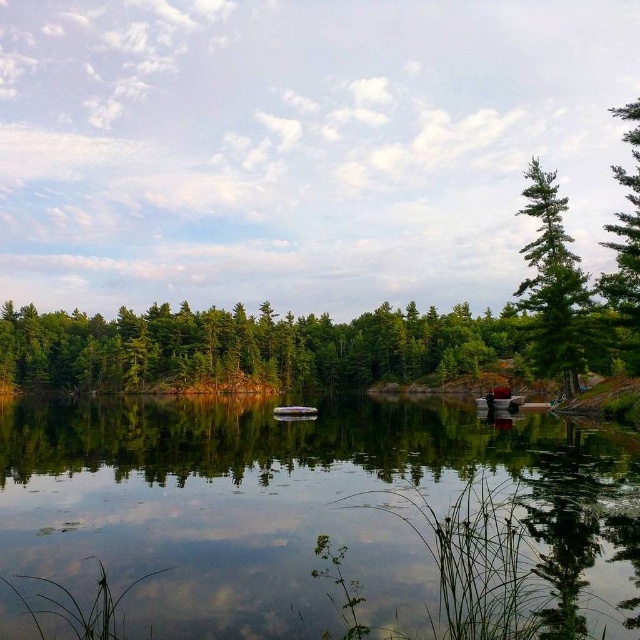
You are planning to take a boat ride on the lake. You see the metallic red boat at lower right and the metallic silver boat at center. Which boat should you choose if you want a larger vessel?

The metallic red boat at lower right is bigger than the metallic silver boat at center, so you should choose the metallic red boat at lower right.

You are standing at the lakeside and want to determine which of the two points, point (614, 304) or point (307, 413), is closer to you. Based on the scene description, which point is nearer?

Point (614, 304) is closer to the viewer than point (307, 413).